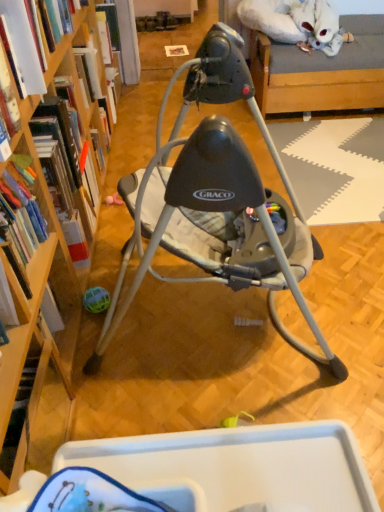
What do you see at coordinates (23, 46) in the screenshot?
I see `hardcover book at left, which appears as the 3th book when ordered from the bottom` at bounding box center [23, 46].

Measure the distance between point (29, 91) and camera.

A distance of 3.95 feet exists between point (29, 91) and camera.

Describe the element at coordinates (20, 220) in the screenshot. I see `hardcover book at left, which is the first book from bottom to top` at that location.

The width and height of the screenshot is (384, 512). Find the location of `hardcover book at left, which appears as the 3th book when viewed from the top`. hardcover book at left, which appears as the 3th book when viewed from the top is located at coordinates (58, 134).

What do you see at coordinates (113, 30) in the screenshot?
I see `hardcover book at upper left, the fourth book from the bottom` at bounding box center [113, 30].

Locate an element on the screen. hardcover book at left, which is the second book in top-to-bottom order is located at coordinates (23, 46).

Measure the distance from hardcover book at upper left, which ranks as the fourth book in front-to-back order, to hardcover book at left, which appears as the 3th book when viewed from the top.

hardcover book at upper left, which ranks as the fourth book in front-to-back order, and hardcover book at left, which appears as the 3th book when viewed from the top, are 5.53 feet apart.

Which is more to the right, hardcover book at upper left, which is the 1th book from back to front, or hardcover book at left, arranged as the third book when viewed from the front?

hardcover book at left, arranged as the third book when viewed from the front.

Is hardcover book at upper left, the fourth book from the bottom, spatially inside hardcover book at left, arranged as the 2th book when ordered from the bottom, or outside of it?

hardcover book at upper left, the fourth book from the bottom, lies outside hardcover book at left, arranged as the 2th book when ordered from the bottom.

Considering the relative sizes of hardcover book at upper left, which ranks as the fourth book in front-to-back order, and hardcover book at left, positioned as the 2th book in back-to-front order, in the image provided, is hardcover book at upper left, which ranks as the fourth book in front-to-back order, shorter than hardcover book at left, positioned as the 2th book in back-to-front order,?

Yes.

Considering the sizes of hardcover book at left, which appears as the 3th book when ordered from the bottom, and hardcover book at upper left, the fourth book from the bottom, in the image, is hardcover book at left, which appears as the 3th book when ordered from the bottom, wider or thinner than hardcover book at upper left, the fourth book from the bottom,?

Considering their sizes, hardcover book at left, which appears as the 3th book when ordered from the bottom, looks broader than hardcover book at upper left, the fourth book from the bottom.

Could you tell me if hardcover book at left, which appears as the 3th book when ordered from the bottom, is facing hardcover book at upper left, which ranks as the fourth book in front-to-back order?

No, hardcover book at left, which appears as the 3th book when ordered from the bottom, is not turned towards hardcover book at upper left, which ranks as the fourth book in front-to-back order.

From the image's perspective, which one is positioned higher, hardcover book at left, which is the second book in top-to-bottom order, or hardcover book at upper left, which ranks as the fourth book in front-to-back order?

hardcover book at upper left, which ranks as the fourth book in front-to-back order, from the image's perspective.

Is the position of hardcover book at left, which appears as the 3th book when ordered from the bottom, less distant than that of hardcover book at upper left, which is the 1th book from back to front?

Yes.

From a real-world perspective, does hardcover book at left, which is the second book in top-to-bottom order, sit lower than hardcover book at left, positioned as the 2th book in back-to-front order?

No, from a real-world perspective, hardcover book at left, which is the second book in top-to-bottom order, is not under hardcover book at left, positioned as the 2th book in back-to-front order.

Considering the positions of points (10, 2) and (73, 155), is point (10, 2) farther from camera compared to point (73, 155)?

No.

In the image, is hardcover book at left, which is the second book in top-to-bottom order, on the left side or the right side of hardcover book at left, which appears as the 3th book when viewed from the top?

In the image, hardcover book at left, which is the second book in top-to-bottom order, appears on the left side of hardcover book at left, which appears as the 3th book when viewed from the top.

Is hardcover book at left, the 3th book positioned from the back, positioned far away from hardcover book at left, arranged as the 2th book when ordered from the bottom?

They are positioned close to each other.

Consider the image. From a real-world perspective, is hardcover book at upper left, the fourth book from the bottom, beneath hardcover book at left, the fourth book positioned from the top?

Correct, in the physical world, hardcover book at upper left, the fourth book from the bottom, is lower than hardcover book at left, the fourth book positioned from the top.

Is hardcover book at upper left, the fourth book from the bottom, oriented away from hardcover book at left, the 1th book from the front?

No, hardcover book at left, the 1th book from the front, is not at the back of hardcover book at upper left, the fourth book from the bottom.

Is hardcover book at upper left, which is the 1th book from back to front, far away from hardcover book at left, the fourth book positioned from the top?

Indeed, hardcover book at upper left, which is the 1th book from back to front, is not near hardcover book at left, the fourth book positioned from the top.

Which of these two, hardcover book at upper left, the first book when ordered from top to bottom, or hardcover book at left, which is the first book from bottom to top, is thinner?

Thinner between the two is hardcover book at upper left, the first book when ordered from top to bottom.

Does hardcover book at left, which appears as the 3th book when viewed from the top, have a greater width compared to hardcover book at left, the 1th book from the front?

Indeed, hardcover book at left, which appears as the 3th book when viewed from the top, has a greater width compared to hardcover book at left, the 1th book from the front.

Is hardcover book at left, which appears as the 3th book when viewed from the top, beside hardcover book at left, which is the first book from bottom to top?

hardcover book at left, which appears as the 3th book when viewed from the top, and hardcover book at left, which is the first book from bottom to top, are clearly separated.

Which object is positioned more to the right, hardcover book at left, positioned as the 2th book in back-to-front order, or hardcover book at left, which is the first book from bottom to top?

hardcover book at left, positioned as the 2th book in back-to-front order, is more to the right.

From the image's perspective, does hardcover book at left, positioned as the 2th book in back-to-front order, appear lower than hardcover book at left, which is the first book from bottom to top?

No.

Which is more to the right, hardcover book at left, which is the first book from bottom to top, or matte gray baby swing at center?

matte gray baby swing at center is more to the right.

This screenshot has height=512, width=384. Identify the location of chair on the right of hardcover book at left, the 1th book from the front. (216, 199).

Is hardcover book at left, placed as the 4th book when sorted from back to front, taller or shorter than matte gray baby swing at center?

Clearly, hardcover book at left, placed as the 4th book when sorted from back to front, is shorter compared to matte gray baby swing at center.

Is hardcover book at left, placed as the 4th book when sorted from back to front, surrounding hardcover book at upper left, the first book when ordered from top to bottom?

Definitely not — hardcover book at upper left, the first book when ordered from top to bottom, is not inside hardcover book at left, placed as the 4th book when sorted from back to front.

Would you say hardcover book at left, placed as the 4th book when sorted from back to front, is to the left or to the right of hardcover book at upper left, the first book when ordered from top to bottom, in the picture?

hardcover book at left, placed as the 4th book when sorted from back to front, is positioned on hardcover book at upper left, the first book when ordered from top to bottom,'s right side.

Locate an element on the screen. The image size is (384, 512). the 3rd book below when counting from the hardcover book at upper left, the fourth book from the bottom (from the image's perspective) is located at coordinates (20, 220).

There is a hardcover book at upper left, which ranks as the fourth book in front-to-back order. Where is `the 1st book above it (from a real-world perspective)`? the 1st book above it (from a real-world perspective) is located at coordinates (58, 134).

Locate an element on the screen. book that is the 2nd object located behind the hardcover book at left, the 3th book positioned from the back is located at coordinates (113, 30).

Estimate the real-world distances between objects in this image. Which object is further from matte gray baby swing at center, hardcover book at left, which appears as the 3th book when viewed from the top, or hardcover book at upper left, the first book when ordered from top to bottom?

→ The object further to matte gray baby swing at center is hardcover book at upper left, the first book when ordered from top to bottom.

Looking at the image, which one is located further to hardcover book at left, placed as the 4th book when sorted from back to front, hardcover book at upper left, which ranks as the fourth book in front-to-back order, or matte gray baby swing at center?

Among the two, hardcover book at upper left, which ranks as the fourth book in front-to-back order, is located further to hardcover book at left, placed as the 4th book when sorted from back to front.

Looking at this image, when comparing their distances from matte gray baby swing at center, does hardcover book at left, arranged as the third book when viewed from the front, or hardcover book at left, placed as the 4th book when sorted from back to front, seem closer?

hardcover book at left, placed as the 4th book when sorted from back to front, is closer to matte gray baby swing at center.

Considering their positions, is hardcover book at left, which is the 2th book in front-to-back order, positioned further to hardcover book at left, positioned as the 2th book in back-to-front order, than hardcover book at left, placed as the 4th book when sorted from back to front?

hardcover book at left, placed as the 4th book when sorted from back to front, is further to hardcover book at left, positioned as the 2th book in back-to-front order.

Considering their positions, is hardcover book at left, which appears as the 3th book when ordered from the bottom, positioned further to hardcover book at left, the fourth book positioned from the top, than hardcover book at left, which appears as the 3th book when viewed from the top?

Among the two, hardcover book at left, which appears as the 3th book when viewed from the top, is located further to hardcover book at left, the fourth book positioned from the top.

When comparing their distances from hardcover book at left, which is the 2th book in front-to-back order, does hardcover book at left, which appears as the 3th book when viewed from the top, or hardcover book at left, placed as the 4th book when sorted from back to front, seem further?

hardcover book at left, placed as the 4th book when sorted from back to front, is positioned further to the anchor hardcover book at left, which is the 2th book in front-to-back order.

Considering their positions, is hardcover book at left, the 3th book positioned from the back, positioned further to hardcover book at left, which is the first book from bottom to top, than matte gray baby swing at center?

matte gray baby swing at center is positioned further to the anchor hardcover book at left, which is the first book from bottom to top.

From the image, which object appears to be farther from matte gray baby swing at center, hardcover book at left, which is the 2th book in front-to-back order, or hardcover book at left, arranged as the third book when viewed from the front?

hardcover book at left, which is the 2th book in front-to-back order, lies further to matte gray baby swing at center than the other object.

Where is `book between hardcover book at left, which is the second book in top-to-bottom order, and hardcover book at upper left, which is the 1th book from back to front, in the front-back direction`? book between hardcover book at left, which is the second book in top-to-bottom order, and hardcover book at upper left, which is the 1th book from back to front, in the front-back direction is located at coordinates (58, 134).

At what (x,y) coordinates should I click in order to perform the action: click on book located between hardcover book at left, the fourth book positioned from the top, and matte gray baby swing at center in the left-right direction. Please return your answer as a coordinate pair (x, y). The width and height of the screenshot is (384, 512). Looking at the image, I should click on (58, 134).

The height and width of the screenshot is (512, 384). I want to click on book that lies between hardcover book at left, the 3th book positioned from the back, and hardcover book at left, placed as the 4th book when sorted from back to front, from top to bottom, so click(x=58, y=134).